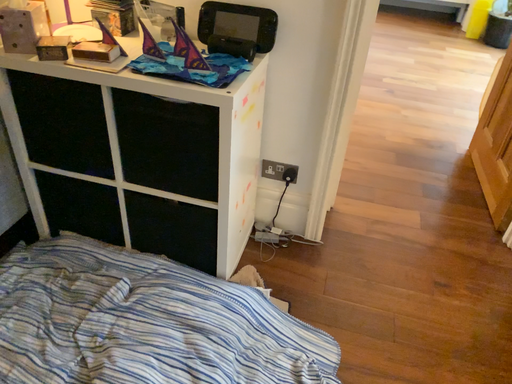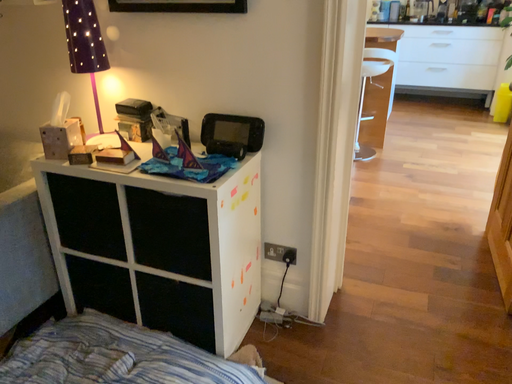
Question: Which way did the camera rotate in the video?

Choices:
 (A) rotated upward
 (B) rotated downward

Answer: (A)